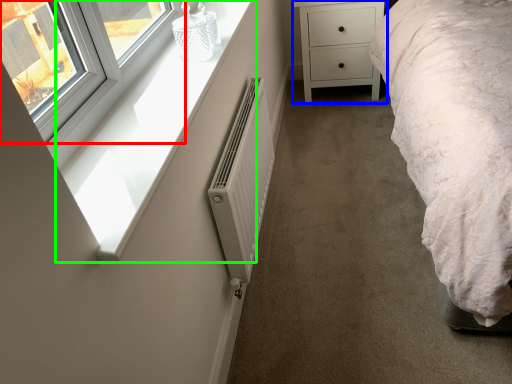
Question: Based on their relative distances, which object is nearer to window (highlighted by a red box)? Choose from chest of drawers (highlighted by a blue box) and window sill (highlighted by a green box).

Choices:
 (A) chest of drawers
 (B) window sill

Answer: (B)